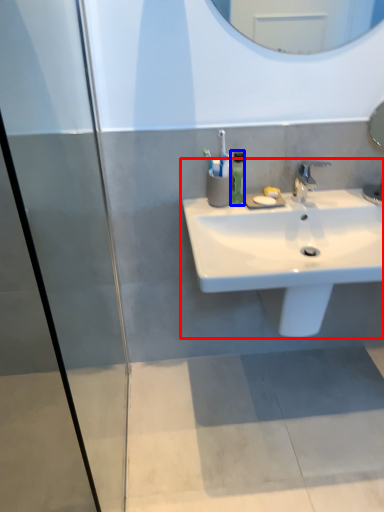
Question: Which of the following is the farthest to the observer, sink (highlighted by a red box) or soap dispenser (highlighted by a blue box)?

Choices:
 (A) sink
 (B) soap dispenser

Answer: (B)